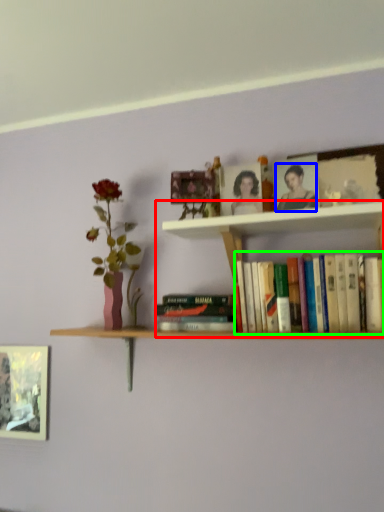
Question: Based on their relative distances, which object is farther from cabinet (highlighted by a red box)? Choose from person (highlighted by a blue box) and book (highlighted by a green box).

Choices:
 (A) person
 (B) book

Answer: (B)